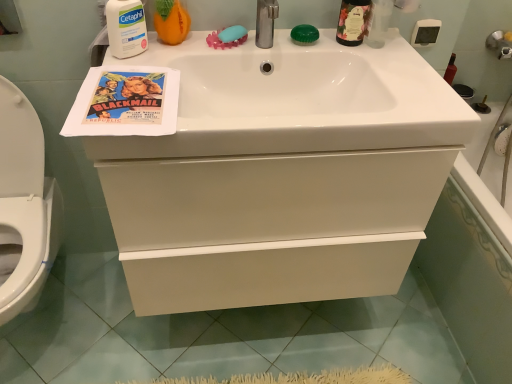
Find the location of a particular element. vacant space in between matte paper poster at upper left and white matte cetaphil at upper left, which appears as the second cleaning product when viewed from the right is located at coordinates (138, 63).